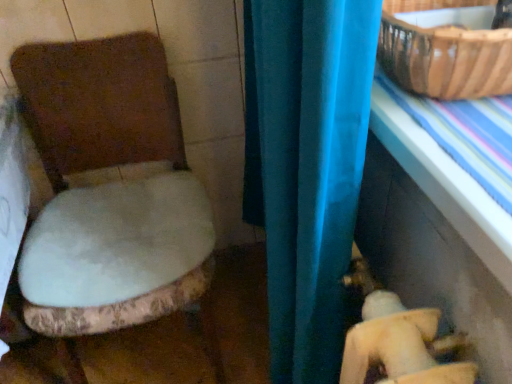
Question: Is brown woven basket at upper right looking in the opposite direction of blue plastic table at right?

Choices:
 (A) no
 (B) yes

Answer: (A)

Question: Is brown woven basket at upper right beside blue plastic table at right?

Choices:
 (A) yes
 (B) no

Answer: (B)

Question: Is the depth of brown woven basket at upper right less than that of blue plastic table at right?

Choices:
 (A) yes
 (B) no

Answer: (B)

Question: Would you consider brown woven basket at upper right to be distant from blue plastic table at right?

Choices:
 (A) yes
 (B) no

Answer: (B)

Question: From the image's perspective, is brown woven basket at upper right on top of blue plastic table at right?

Choices:
 (A) yes
 (B) no

Answer: (A)

Question: From a real-world perspective, relative to brown woven basket at upper right, is white plush toilet seat at left vertically above or below?

Choices:
 (A) above
 (B) below

Answer: (B)

Question: Based on their sizes in the image, would you say white plush toilet seat at left is bigger or smaller than brown woven basket at upper right?

Choices:
 (A) big
 (B) small

Answer: (A)

Question: Looking at their shapes, would you say white plush toilet seat at left is wider or thinner than brown woven basket at upper right?

Choices:
 (A) thin
 (B) wide

Answer: (B)

Question: From the image's perspective, is white plush toilet seat at left positioned above or below brown woven basket at upper right?

Choices:
 (A) above
 (B) below

Answer: (B)

Question: Considering the positions of blue plastic table at right and brown woven basket at upper right in the image, is blue plastic table at right bigger or smaller than brown woven basket at upper right?

Choices:
 (A) big
 (B) small

Answer: (A)

Question: From the image's perspective, is blue plastic table at right above or below brown woven basket at upper right?

Choices:
 (A) above
 (B) below

Answer: (B)

Question: Based on their positions, is blue plastic table at right located to the left or right of brown woven basket at upper right?

Choices:
 (A) right
 (B) left

Answer: (B)

Question: In terms of width, does blue plastic table at right look wider or thinner when compared to brown woven basket at upper right?

Choices:
 (A) wide
 (B) thin

Answer: (A)

Question: From a real-world perspective, is brown woven basket at upper right positioned above or below white plush toilet seat at left?

Choices:
 (A) above
 (B) below

Answer: (A)

Question: Would you say brown woven basket at upper right is inside or outside white plush toilet seat at left?

Choices:
 (A) inside
 (B) outside

Answer: (B)